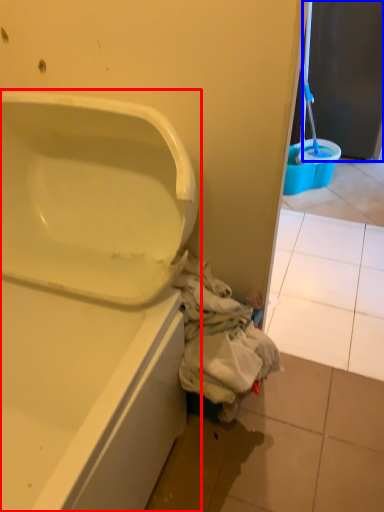
Question: Which point is further to the camera, bathtub (highlighted by a red box) or screen door (highlighted by a blue box)?

Choices:
 (A) bathtub
 (B) screen door

Answer: (B)